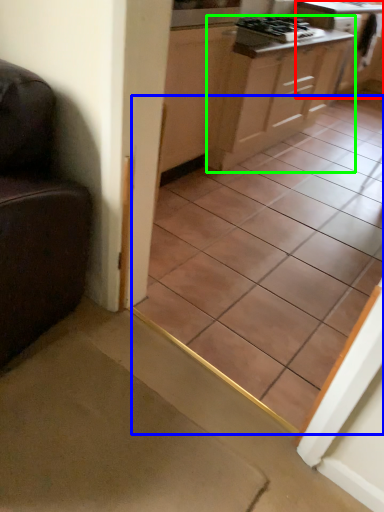
Question: Which is farther away from cabinetry (highlighted by a red box)? ceramic tile (highlighted by a blue box) or cabinetry (highlighted by a green box)?

Choices:
 (A) ceramic tile
 (B) cabinetry

Answer: (A)